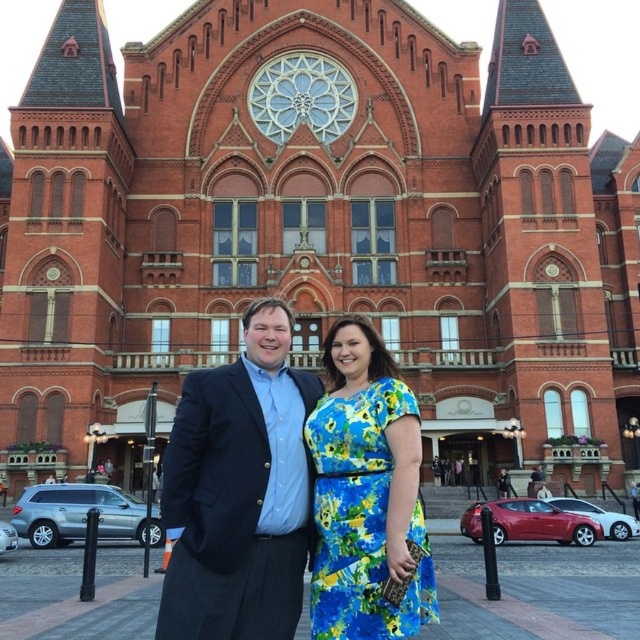
Question: From the image, what is the correct spatial relationship of matte black suit at center in relation to floral print fabric dress at center?

Choices:
 (A) above
 (B) below

Answer: (A)

Question: Does matte black suit at center lie in front of floral print fabric dress at center?

Choices:
 (A) yes
 (B) no

Answer: (A)

Question: Which object is closer to the camera taking this photo?

Choices:
 (A) matte black suit at center
 (B) floral print fabric dress at center

Answer: (A)

Question: Is matte black suit at center smaller than floral print fabric dress at center?

Choices:
 (A) yes
 (B) no

Answer: (B)

Question: Which object appears closest to the camera in this image?

Choices:
 (A) floral print fabric dress at center
 (B) matte black suit at center

Answer: (B)